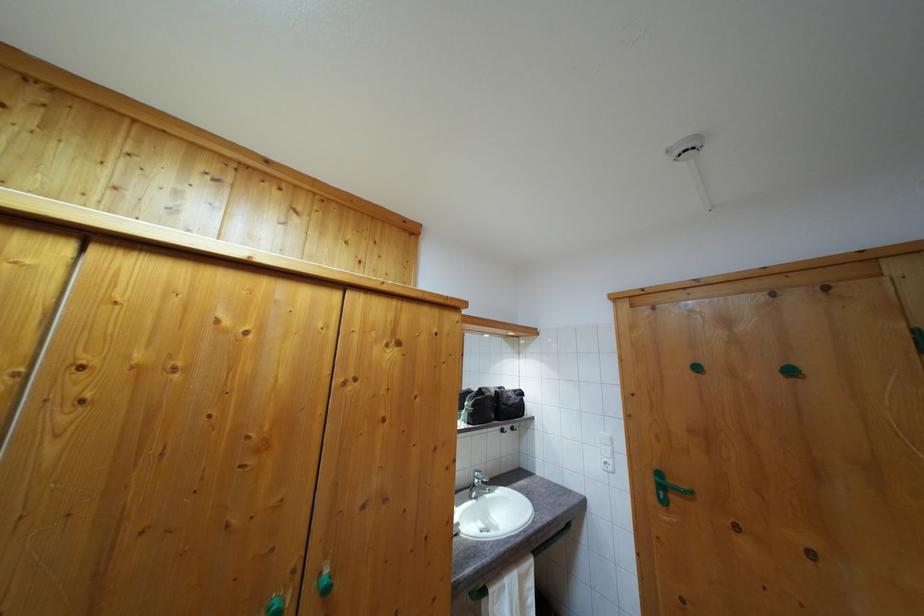
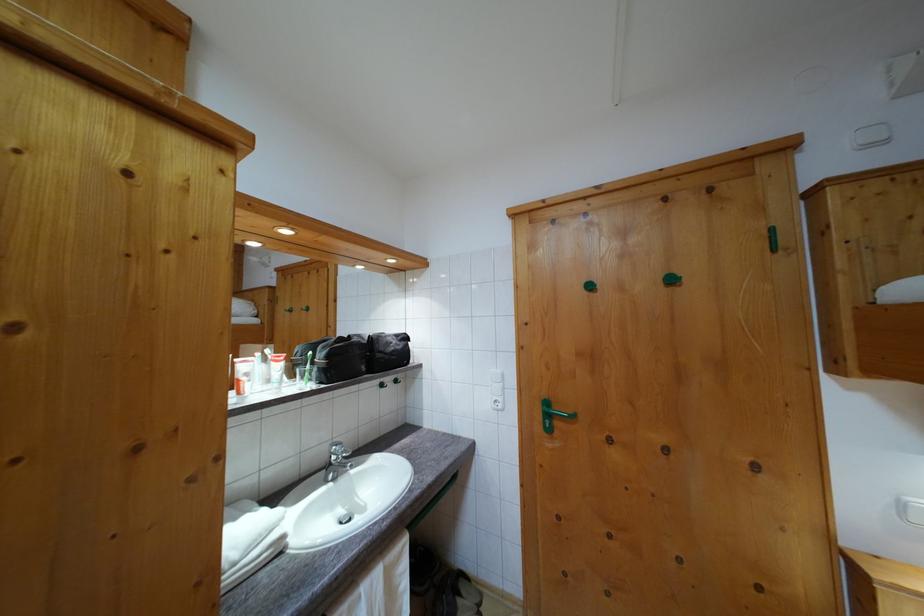
The point at (x=477, y=413) is marked in the first image. Where is the corresponding point in the second image?

(332, 363)